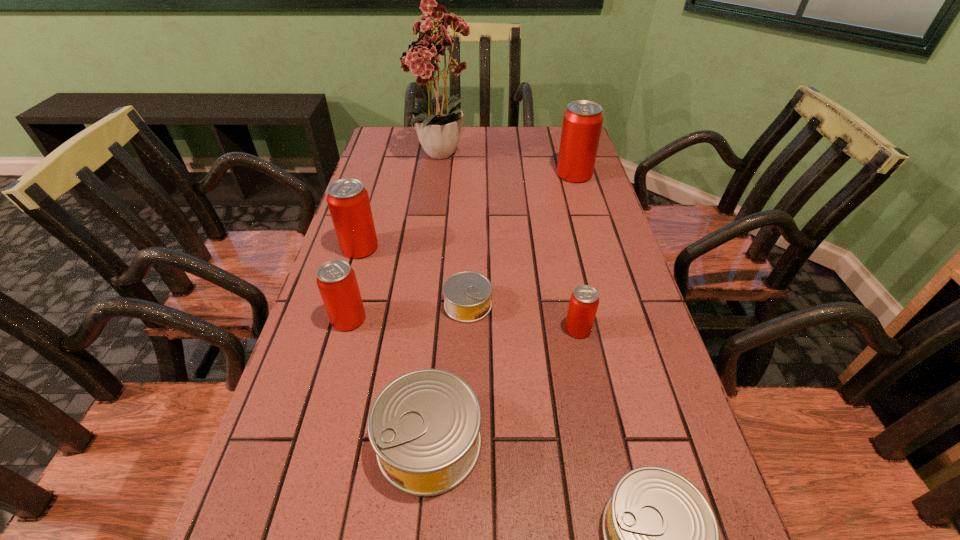
The width and height of the screenshot is (960, 540). Identify the location of flower arrangement positioned at the left edge. (439, 127).

Where is `object present at the far left corner`? This screenshot has width=960, height=540. object present at the far left corner is located at coordinates (439, 127).

Where is `vacant area at the far edge`? vacant area at the far edge is located at coordinates (497, 147).

In the image, there is a desktop. What are the coordinates of `vacant space at the left edge` in the screenshot? It's located at (370, 266).

I want to click on vacant space at the right edge, so click(606, 394).

Find the location of a particular element. Image resolution: width=960 pixels, height=540 pixels. free region at the far left corner of the desktop is located at coordinates (411, 151).

Locate an element on the screen. The image size is (960, 540). free space that is in between the smallest red can and the third tallest can is located at coordinates pyautogui.click(x=464, y=324).

At what (x,y) coordinates should I click in order to perform the action: click on unoccupied position between the second tallest can and the biggest silver can. Please return your answer as a coordinate pair (x, y). Looking at the image, I should click on (395, 345).

You are a GUI agent. You are given a task and a screenshot of the screen. Output one action in this format:
    pyautogui.click(x=<x>, y=<y>)
    Task: Click on the empty space that is in between the biggest silver can and the second farthest red can
    Image resolution: width=960 pixels, height=540 pixels.
    Given the screenshot: What is the action you would take?
    pyautogui.click(x=395, y=345)

Image resolution: width=960 pixels, height=540 pixels. I want to click on vacant area that lies between the smallest silver can and the pink flower arrangement, so click(x=456, y=230).